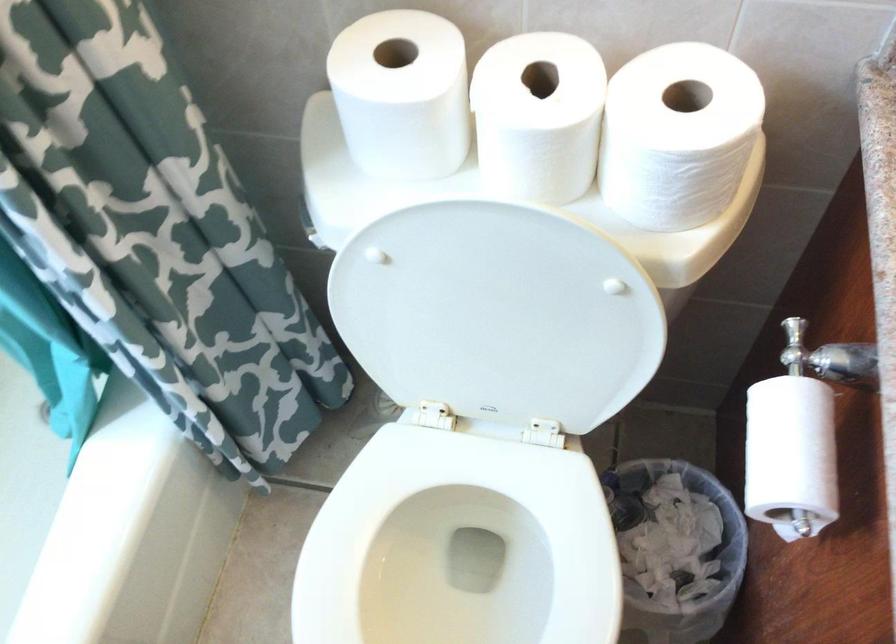
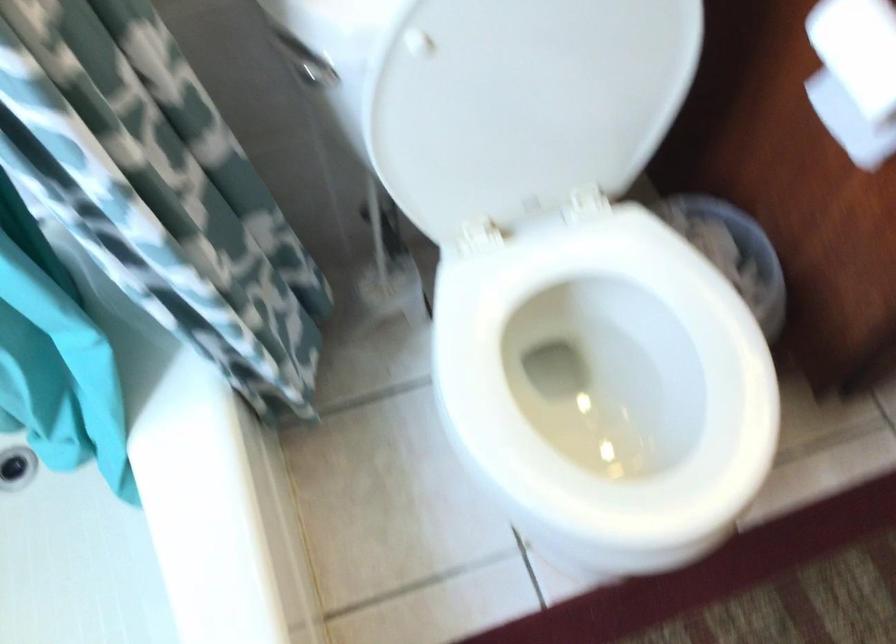
In the second image, find the point that corresponds to point 319,220 in the first image.

(304, 64)